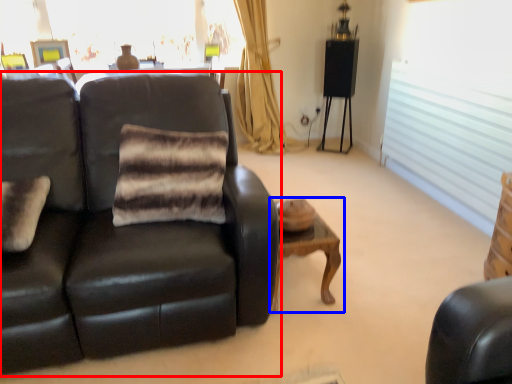
Question: Which of the following is the farthest to the observer, studio couch (highlighted by a red box) or table (highlighted by a blue box)?

Choices:
 (A) studio couch
 (B) table

Answer: (B)